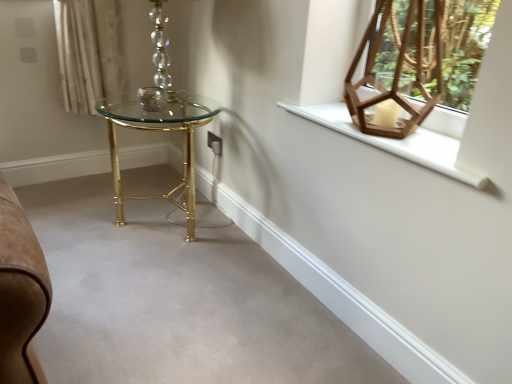
Question: Can you confirm if gold metallic table at center is smaller than matte glass candle holder at center?

Choices:
 (A) no
 (B) yes

Answer: (A)

Question: Is gold metallic table at center surrounding matte glass candle holder at center?

Choices:
 (A) yes
 (B) no

Answer: (B)

Question: From the image's perspective, is gold metallic table at center on top of matte glass candle holder at center?

Choices:
 (A) no
 (B) yes

Answer: (A)

Question: Is gold metallic table at center bigger than matte glass candle holder at center?

Choices:
 (A) yes
 (B) no

Answer: (A)

Question: Is gold metallic table at center at the left side of matte glass candle holder at center?

Choices:
 (A) no
 (B) yes

Answer: (A)

Question: From the image's perspective, is matte glass candle holder at center located above or below gold metallic table at center?

Choices:
 (A) below
 (B) above

Answer: (B)

Question: In terms of width, does matte glass candle holder at center look wider or thinner when compared to gold metallic table at center?

Choices:
 (A) wide
 (B) thin

Answer: (B)

Question: Considering the positions of matte glass candle holder at center and gold metallic table at center in the image, is matte glass candle holder at center taller or shorter than gold metallic table at center?

Choices:
 (A) short
 (B) tall

Answer: (A)

Question: Is matte glass candle holder at center bigger or smaller than gold metallic table at center?

Choices:
 (A) big
 (B) small

Answer: (B)

Question: Is matte glass candle holder at center spatially inside white wooden window sill at upper right, or outside of it?

Choices:
 (A) outside
 (B) inside

Answer: (A)

Question: From their relative heights in the image, would you say matte glass candle holder at center is taller or shorter than white wooden window sill at upper right?

Choices:
 (A) tall
 (B) short

Answer: (A)

Question: Is matte glass candle holder at center bigger or smaller than white wooden window sill at upper right?

Choices:
 (A) small
 (B) big

Answer: (A)

Question: Looking at their shapes, would you say matte glass candle holder at center is wider or thinner than white wooden window sill at upper right?

Choices:
 (A) thin
 (B) wide

Answer: (A)

Question: From a real-world perspective, is matte glass candle holder at center above or below wooden hexagonal lantern at upper right?

Choices:
 (A) below
 (B) above

Answer: (A)

Question: Would you say matte glass candle holder at center is to the left or to the right of wooden hexagonal lantern at upper right in the picture?

Choices:
 (A) right
 (B) left

Answer: (B)